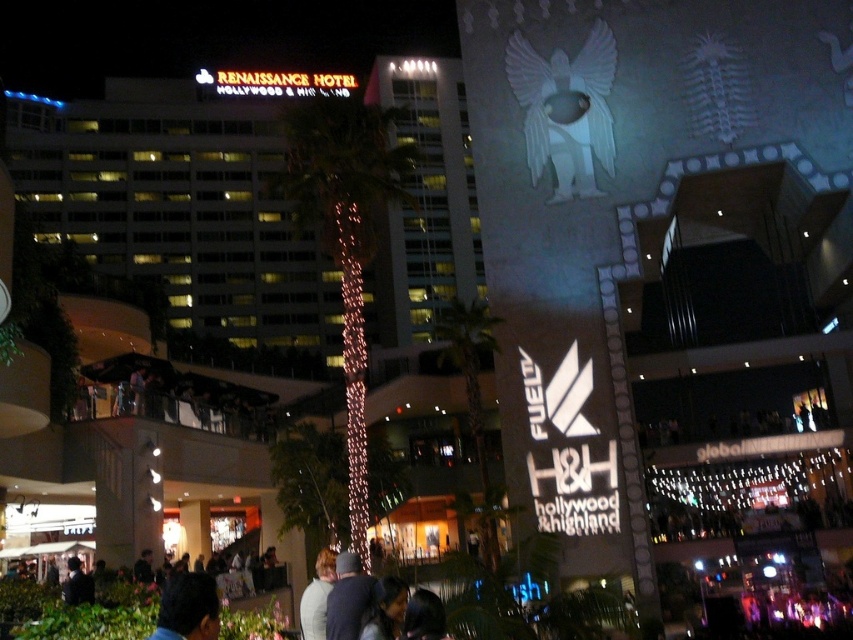
Measure the distance between point (379,262) and camera.

Point (379,262) is 141.66 meters from camera.

Is matte glass hotel at upper left to the right of dark gray knit cap at lower center from the viewer's perspective?

In fact, matte glass hotel at upper left is to the left of dark gray knit cap at lower center.

The height and width of the screenshot is (640, 853). I want to click on matte glass hotel at upper left, so click(x=180, y=204).